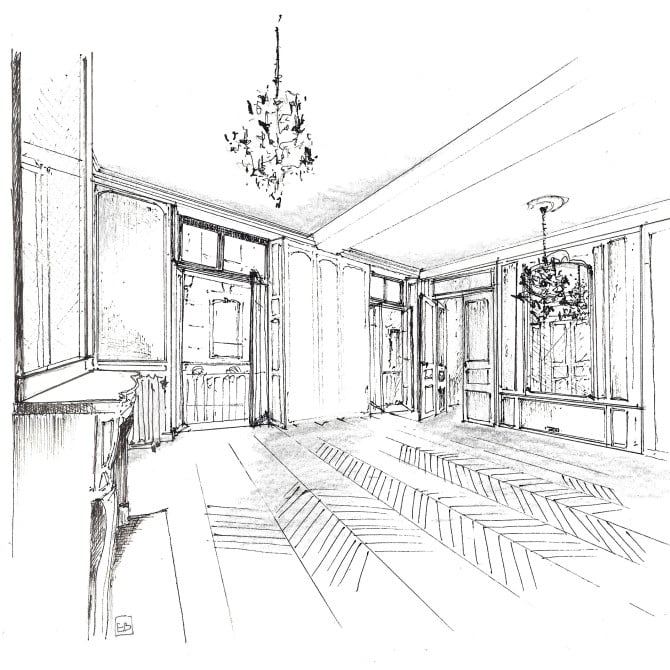
Identify the location of doorways. (224, 354), (452, 368).